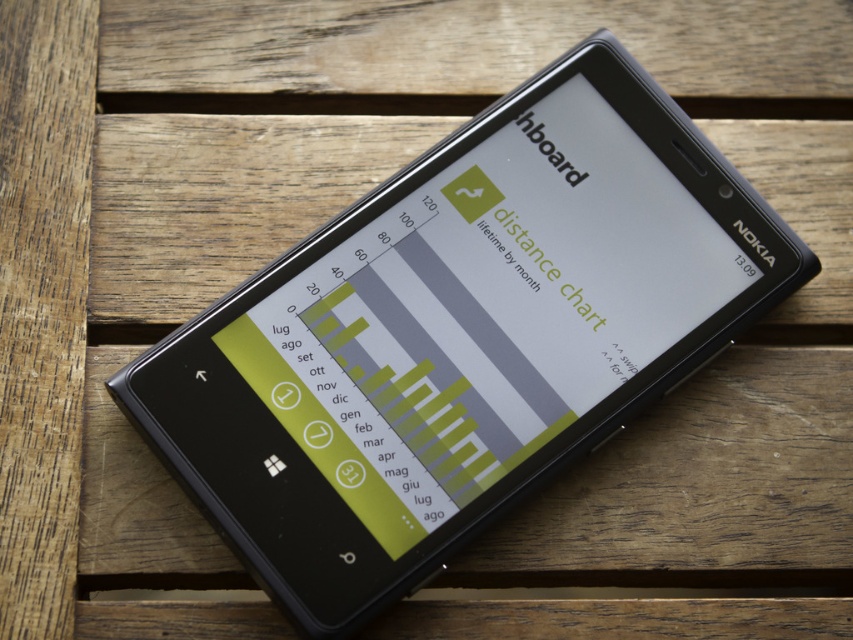
Who is higher up, matte black phone at center or green matte text at center?

matte black phone at center is above.

Can you confirm if matte black phone at center is taller than green matte text at center?

Yes, matte black phone at center is taller than green matte text at center.

What do you see at coordinates (485, 312) in the screenshot? This screenshot has width=853, height=640. I see `matte black phone at center` at bounding box center [485, 312].

Locate an element on the screen. matte black phone at center is located at coordinates (485, 312).